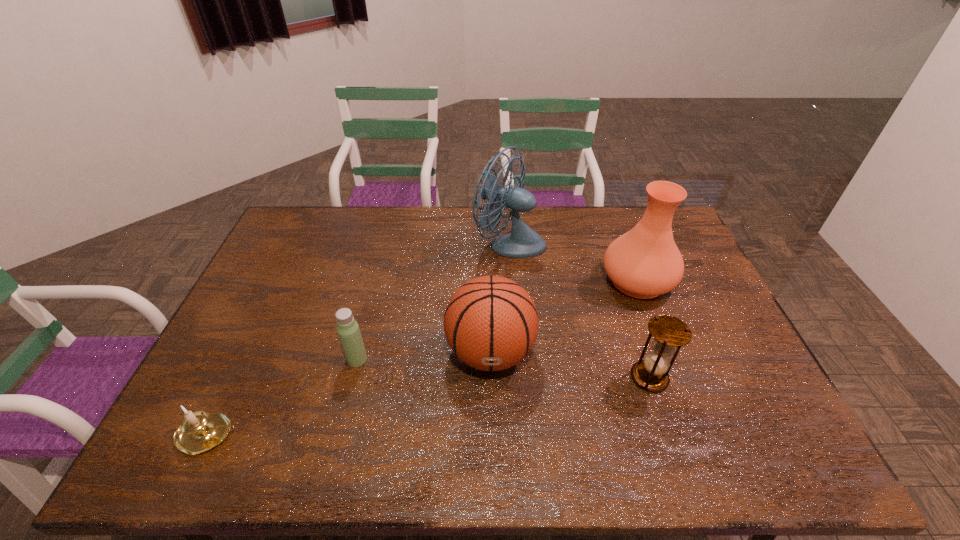
What are the coordinates of `blank space located on the front of the vase` in the screenshot? It's located at coord(672,372).

The height and width of the screenshot is (540, 960). Identify the location of free region located on the side where the inflation valve is located. (492, 451).

The height and width of the screenshot is (540, 960). In order to click on vacant space located on the back of the hourglass in this screenshot , I will do `click(639, 347)`.

This screenshot has height=540, width=960. What are the coordinates of `free point located on the left of the fifth object from right to left` in the screenshot? It's located at (328, 359).

Find the location of a particular element. The width and height of the screenshot is (960, 540). free space located on the handle side of the shortest object is located at coordinates (393, 435).

The image size is (960, 540). What are the coordinates of `object at the far edge` in the screenshot? It's located at (523, 242).

The image size is (960, 540). Find the location of `object at the near edge`. object at the near edge is located at coordinates pos(199,432).

Locate an element on the screen. This screenshot has width=960, height=540. object situated at the left edge is located at coordinates (199, 432).

Image resolution: width=960 pixels, height=540 pixels. What are the coordinates of `object situated at the right edge` in the screenshot? It's located at (643, 263).

The height and width of the screenshot is (540, 960). In order to click on object that is at the near left corner in this screenshot , I will do `click(199, 432)`.